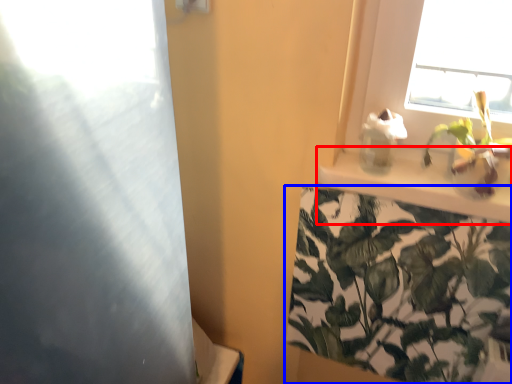
Question: Which point is further to the camera, window sill (highlighted by a red box) or houseplant (highlighted by a blue box)?

Choices:
 (A) window sill
 (B) houseplant

Answer: (B)